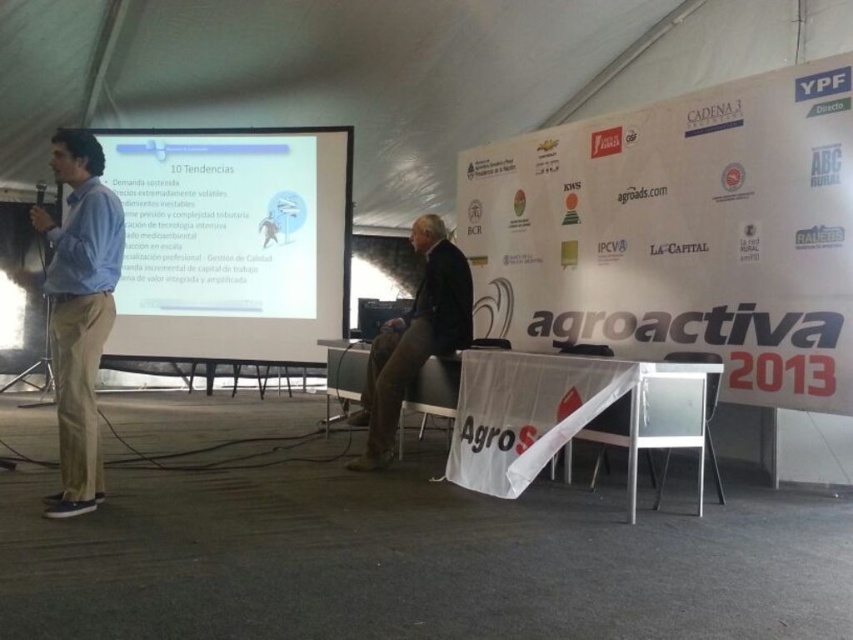
You are an attendee at the Agroactiva 2013 conference. You notice the white paper banner at upper center and the light blue shirt at left. Which object is taller in the image?

The white paper banner at upper center is much taller than the light blue shirt at left.

You are attending the Agroactiva 2013 conference and notice the white paper banner at upper center and the light blue shirt at left. From your seated position in the audience, which object is positioned higher in the image?

The white paper banner at upper center is positioned higher than the light blue shirt at left.

You are an attendee at the Agroactiva 2013 conference. You want to take a photo of the presentation slide on the white matte projection screen at center without the light blue shirt at left appearing in the frame. Is the screen wide enough to do so?

The white matte projection screen at center is wider than the light blue shirt at left, so yes, it is possible to take a photo of the presentation slide on the white matte projection screen at center without the light blue shirt at left appearing in the frame.